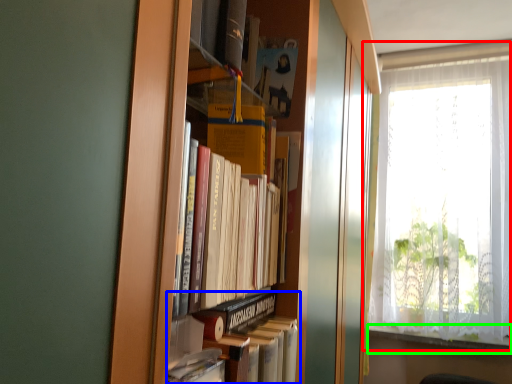
Question: Considering the real-world distances, which object is closest to window (highlighted by a red box)? book (highlighted by a blue box) or window sill (highlighted by a green box).

Choices:
 (A) book
 (B) window sill

Answer: (B)